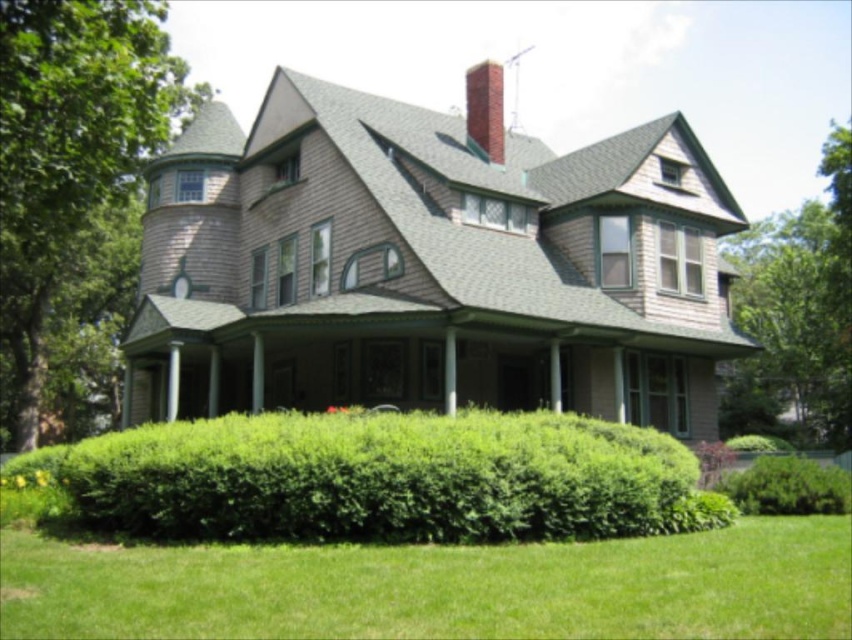
Can you confirm if green grass at lower center is shorter than green leafy hedge at lower center?

Yes, green grass at lower center is shorter than green leafy hedge at lower center.

Describe the element at coordinates (439, 588) in the screenshot. This screenshot has height=640, width=852. I see `green grass at lower center` at that location.

At what (x,y) coordinates should I click in order to perform the action: click on green grass at lower center. Please return your answer as a coordinate pair (x, y). This screenshot has height=640, width=852. Looking at the image, I should click on (439, 588).

Consider the image. Is green leafy tree at left wider than green leafy hedge at lower right?

Correct, the width of green leafy tree at left exceeds that of green leafy hedge at lower right.

Which is more to the left, green leafy tree at left or green leafy hedge at lower right?

From the viewer's perspective, green leafy tree at left appears more on the left side.

Which is behind, point (140, 97) or point (830, 499)?

Point (140, 97)

This screenshot has height=640, width=852. What are the coordinates of `green leafy tree at left` in the screenshot? It's located at 73,188.

Is green leafy tree at upper right to the right of red brick chimney at upper center from the viewer's perspective?

Correct, you'll find green leafy tree at upper right to the right of red brick chimney at upper center.

Does green leafy tree at upper right come in front of red brick chimney at upper center?

Yes, it is.

At what (x,y) coordinates should I click in order to perform the action: click on green leafy tree at upper right. Please return your answer as a coordinate pair (x, y). Looking at the image, I should click on (796, 314).